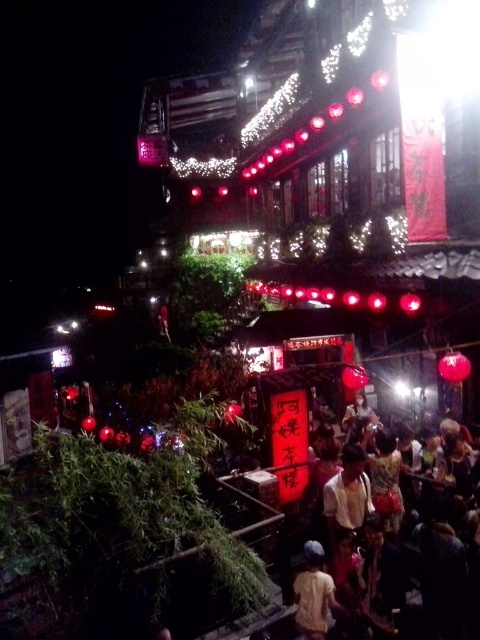
Question: Does matte black crowd at lower center appear on the right side of light yellow fabric at center?

Choices:
 (A) yes
 (B) no

Answer: (A)

Question: Does matte black crowd at lower center appear on the right side of light yellow fabric at center?

Choices:
 (A) no
 (B) yes

Answer: (B)

Question: Which point is closer to the camera taking this photo?

Choices:
 (A) (458, 593)
 (B) (299, 580)

Answer: (A)

Question: Does matte black crowd at lower center appear over light yellow fabric at center?

Choices:
 (A) yes
 (B) no

Answer: (A)

Question: Which point is farther to the camera?

Choices:
 (A) (315, 630)
 (B) (432, 612)

Answer: (B)